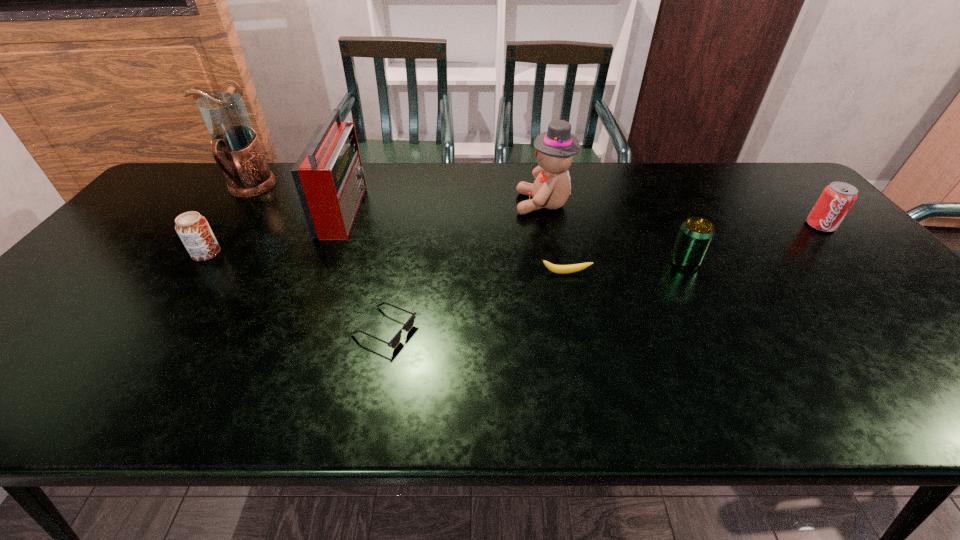
Locate an element on the screen. free spot between the rightmost object and the right beer can is located at coordinates (753, 244).

Identify the location of free area in between the second object from right to left and the rag_doll. (614, 232).

This screenshot has height=540, width=960. What are the coordinates of `free spot between the rag_doll and the sunglasses` in the screenshot? It's located at (464, 267).

You are a GUI agent. You are given a task and a screenshot of the screen. Output one action in this format:
    pyautogui.click(x=<x>, y=<y>)
    Task: Click on the unoccupied position between the third object from left to right and the left beer can
    
    Given the screenshot: What is the action you would take?
    pyautogui.click(x=275, y=232)

Find the location of a particular element. Image resolution: width=960 pixels, height=540 pixels. empty location between the seventh tallest object and the shortest object is located at coordinates (475, 301).

The height and width of the screenshot is (540, 960). What are the coordinates of `unoccupied area between the pitcher and the seventh tallest object` in the screenshot? It's located at (408, 231).

You are a GUI agent. You are given a task and a screenshot of the screen. Output one action in this format:
    pyautogui.click(x=<x>, y=<y>)
    Task: Click on the unoccupied area between the banana and the pitcher
    This screenshot has height=540, width=960.
    Given the screenshot: What is the action you would take?
    pyautogui.click(x=408, y=231)

Find the location of a particular element. This screenshot has width=960, height=540. object that is the seventh closest to the left beer can is located at coordinates (837, 198).

Point out which object is positioned as the fourth nearest to the second shortest object. Please provide its 2D coordinates. Your answer should be formatted as a tuple, i.e. [(x, y)], where the tuple contains the x and y coordinates of a point satisfying the conditions above.

[(328, 175)]

This screenshot has width=960, height=540. Find the location of `vacant position in the image that satisfies the following two spatial constraints: 1. on the upward curve of the seventh tallest object; 2. on the lenses of the sunglasses`. vacant position in the image that satisfies the following two spatial constraints: 1. on the upward curve of the seventh tallest object; 2. on the lenses of the sunglasses is located at coordinates (578, 329).